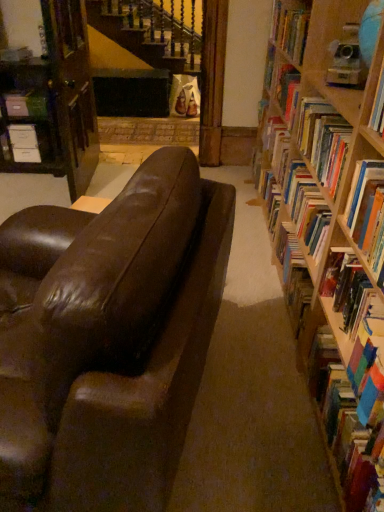
Question: From a real-world perspective, is hardcover book at upper right, which appears as the 1th book when viewed from the back, above or below matte white paperback book at center?

Choices:
 (A) above
 (B) below

Answer: (A)

Question: Looking at their shapes, would you say hardcover book at upper right, the 4th book in the front-to-back sequence, is wider or thinner than matte white paperback book at center?

Choices:
 (A) thin
 (B) wide

Answer: (B)

Question: Estimate the real-world distances between objects in this image. Which object is farther from the wooden bookcase at left?

Choices:
 (A) hardcover book at upper right, the 4th book in the front-to-back sequence
 (B) multicolored paperbacks at right, the first book positioned from the bottom
 (C) hardcover book at right, marked as the second book in a top-to-bottom arrangement
 (D) matte black file cabinet at left
 (E) shiny brown leather couch at center

Answer: (B)

Question: Estimate the real-world distances between objects in this image. Which object is farther from the hardcover book at upper right, the 4th book in the front-to-back sequence?

Choices:
 (A) hardcover book at right, acting as the 2th book starting from the back
 (B) hardcover book at right, which is the 4th book from back to front
 (C) multicolored paperbacks at right, positioned as the 4th book in top-to-bottom order
 (D) matte black file cabinet at left
 (E) matte white paperback book at center

Answer: (E)